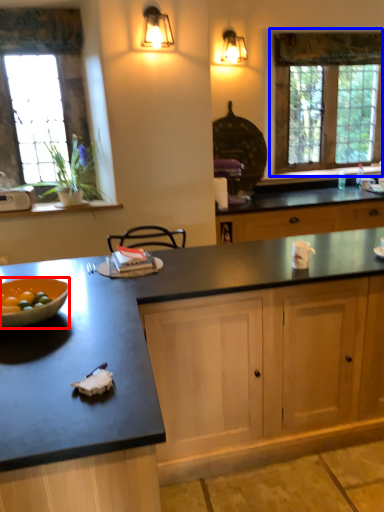
Question: Among these objects, which one is farthest to the camera, bowl (highlighted by a red box) or window (highlighted by a blue box)?

Choices:
 (A) bowl
 (B) window

Answer: (B)